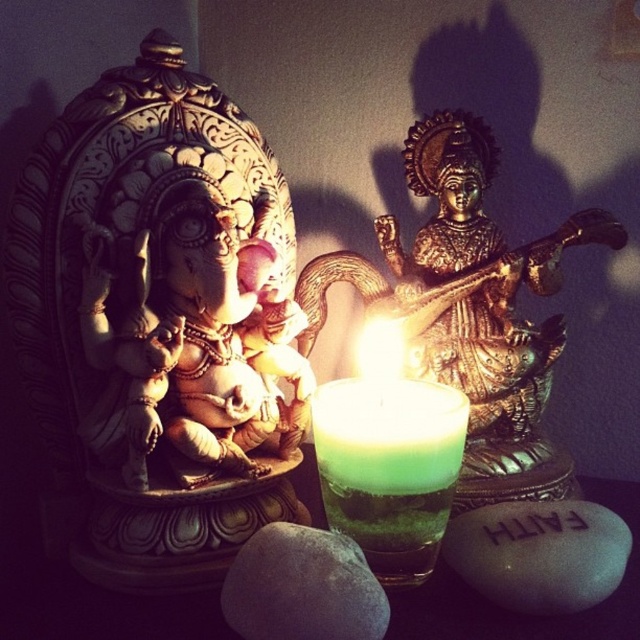
Does point (429, 406) lie behind point (244, 595)?

That is True.

Who is more forward, (x=356, y=417) or (x=317, y=563)?

Positioned in front is point (x=317, y=563).

This screenshot has height=640, width=640. In order to click on green wax candle at center in this screenshot , I will do [388, 468].

Which of these two, white smooth stone at center or gray matte rock at center, stands shorter?

Standing shorter between the two is gray matte rock at center.

Is white smooth stone at center to the right of gray matte rock at center from the viewer's perspective?

Indeed, white smooth stone at center is positioned on the right side of gray matte rock at center.

Which is in front, point (445, 561) or point (256, 602)?

Point (256, 602)

Identify the location of white smooth stone at center. This screenshot has height=640, width=640. (540, 554).

Between point (401, 404) and point (604, 532), which one is positioned behind?

The point (401, 404) is more distant.

Measure the distance between point [392,550] and camera.

A distance of 28.68 inches exists between point [392,550] and camera.

The width and height of the screenshot is (640, 640). What do you see at coordinates (388, 468) in the screenshot? I see `green wax candle at center` at bounding box center [388, 468].

The height and width of the screenshot is (640, 640). I want to click on green wax candle at center, so click(x=388, y=468).